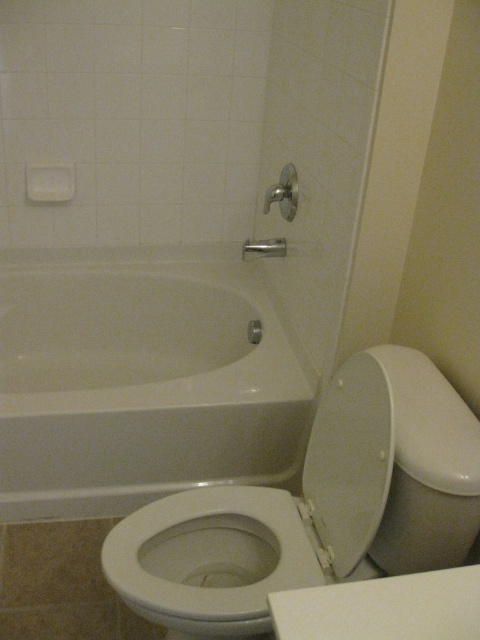
Question: From the image, what is the correct spatial relationship of white glossy toilet at lower right in relation to white glossy toilet bowl at lower center?

Choices:
 (A) right
 (B) left

Answer: (A)

Question: Considering the real-world distances, which object is closest to the matte silver shower handle at upper center?

Choices:
 (A) brushed metal faucet at upper center
 (B) white glossy bathtub at center

Answer: (A)

Question: Can you confirm if white glossy toilet at lower right is positioned to the right of matte silver shower handle at upper center?

Choices:
 (A) no
 (B) yes

Answer: (B)

Question: Can you confirm if white glossy bathtub at center is positioned to the right of white glossy toilet at lower right?

Choices:
 (A) no
 (B) yes

Answer: (A)

Question: Among these objects, which one is farthest from the camera?

Choices:
 (A) matte silver shower handle at upper center
 (B) brushed metal faucet at upper center

Answer: (A)

Question: Which of the following is the farthest from the observer?

Choices:
 (A) (179, 596)
 (B) (255, 253)

Answer: (B)